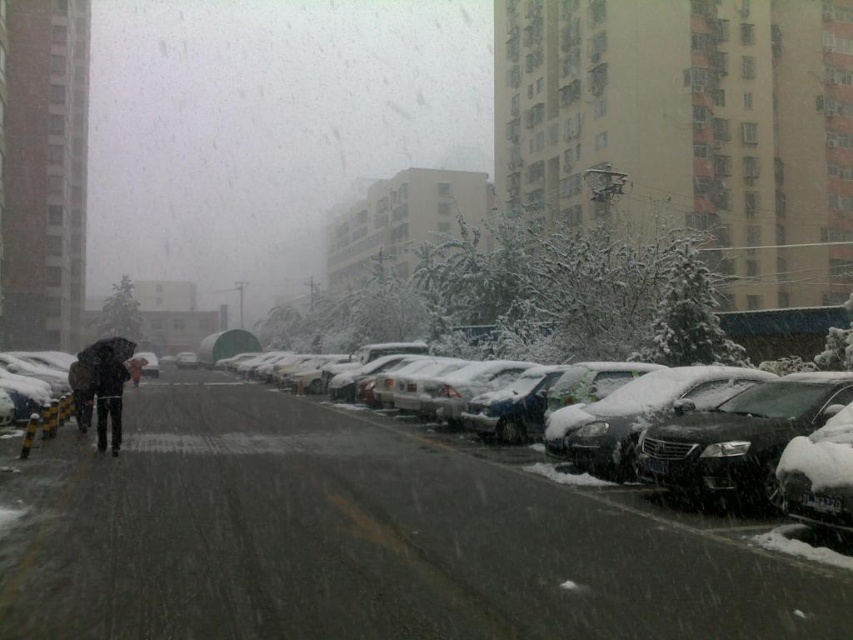
Is dark gray fabric coat at center to the left of dark gray fabric umbrella at left from the viewer's perspective?

Incorrect, dark gray fabric coat at center is not on the left side of dark gray fabric umbrella at left.

Identify the location of dark gray fabric coat at center. The image size is (853, 640). (108, 396).

Can you confirm if dark gray fabric coat at center is thinner than snow-covered sedan at center?

Yes, dark gray fabric coat at center is thinner than snow-covered sedan at center.

Who is positioned more to the right, dark gray fabric coat at center or snow-covered sedan at center?

dark gray fabric coat at center is more to the right.

Measure the distance between dark gray fabric coat at center and camera.

dark gray fabric coat at center and camera are 45.40 feet apart.

You are a GUI agent. You are given a task and a screenshot of the screen. Output one action in this format:
    pyautogui.click(x=<x>, y=<y>)
    Task: Click on the dark gray fabric coat at center
    
    Given the screenshot: What is the action you would take?
    pyautogui.click(x=108, y=396)

Image resolution: width=853 pixels, height=640 pixels. What do you see at coordinates (747, 417) in the screenshot?
I see `snow-covered car at center` at bounding box center [747, 417].

Identify the location of snow-covered car at center. (747, 417).

The image size is (853, 640). I want to click on snow-covered car at center, so click(747, 417).

The image size is (853, 640). In order to click on snow-covered car at center in this screenshot , I will do point(747,417).